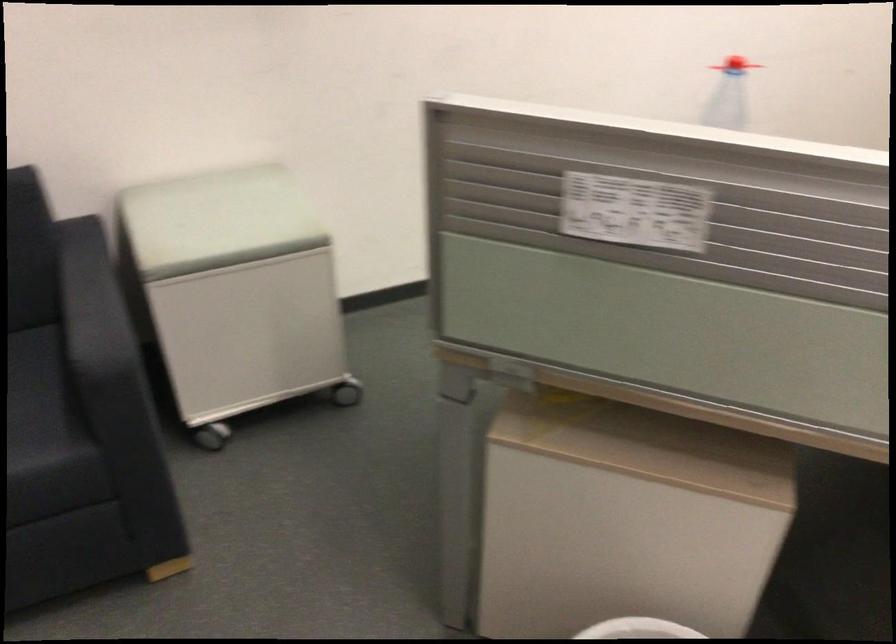
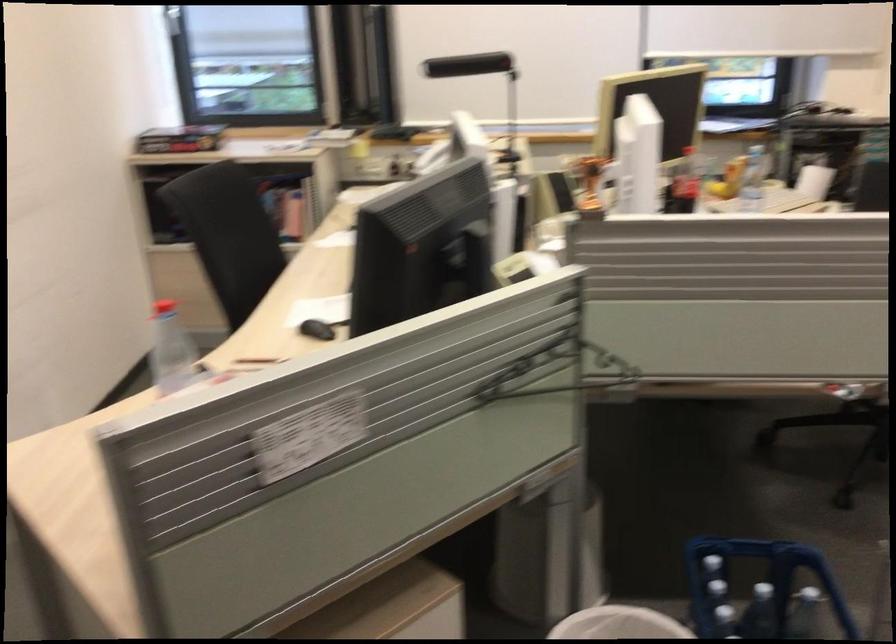
Question: The camera is either moving clockwise (left) or counter-clockwise (right) around the object. The first image is from the beginning of the video and the second image is from the end. Is the camera moving left or right when shooting the video?

Choices:
 (A) Left
 (B) Right

Answer: (A)